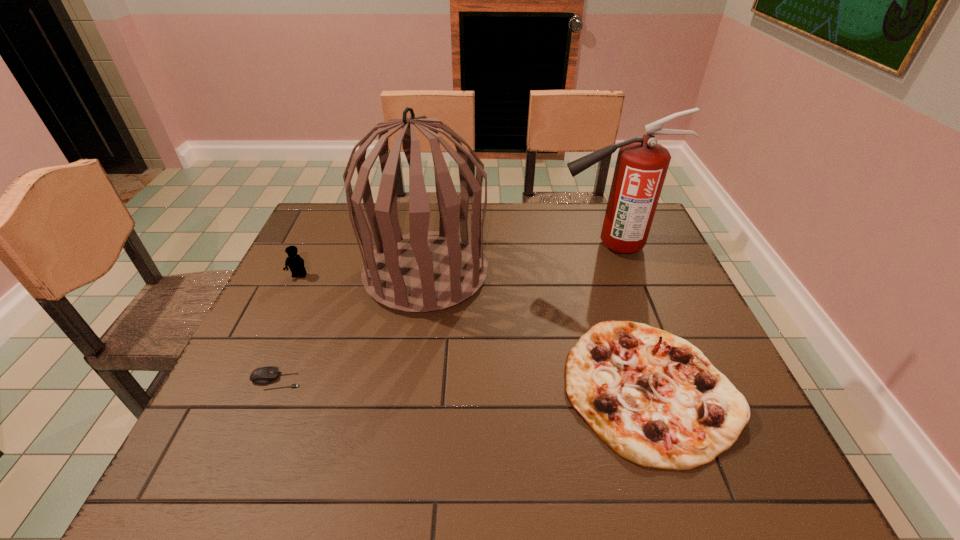
You are a GUI agent. You are given a task and a screenshot of the screen. Output one action in this format:
    pyautogui.click(x=<x>, y=<y>)
    Task: Click on the free region located on the back of the second shortest object
    This screenshot has width=960, height=540.
    Given the screenshot: What is the action you would take?
    pyautogui.click(x=599, y=242)

Locate an element on the screen. This screenshot has width=960, height=540. free point located 0.070m on the front of the shortest object is located at coordinates (259, 419).

Identify the location of birdcage at the far edge. The height and width of the screenshot is (540, 960). (423, 271).

The image size is (960, 540). Identify the location of fire extinguisher that is at the far edge. (642, 164).

Locate an element on the screen. object located at the near edge is located at coordinates (653, 398).

Where is `Lego at the left edge`? Lego at the left edge is located at coordinates (295, 263).

You are a GUI agent. You are given a task and a screenshot of the screen. Output one action in this format:
    pyautogui.click(x=<x>, y=<y>)
    Task: Click on the mouse that is at the left edge
    
    Given the screenshot: What is the action you would take?
    pyautogui.click(x=265, y=375)

Identify the location of fire extinguisher situated at the right edge. This screenshot has width=960, height=540. (642, 164).

Locate an element on the screen. This screenshot has width=960, height=540. pizza that is at the right edge is located at coordinates (653, 398).

What are the coordinates of `object located in the far right corner section of the desktop` in the screenshot? It's located at (642, 164).